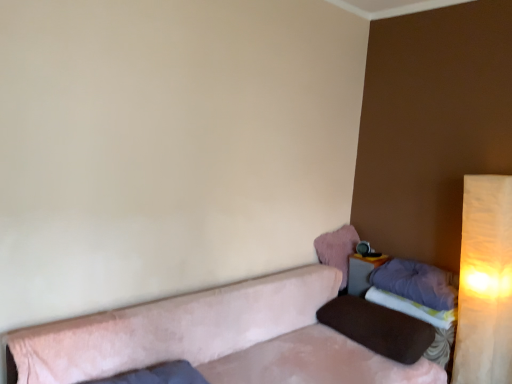
Question: From a real-world perspective, is suede-like beige couch at lower right positioned above or below warm beige fabric lampshade at right?

Choices:
 (A) below
 (B) above

Answer: (A)

Question: From the image's perspective, is suede-like beige couch at lower right positioned above or below warm beige fabric lampshade at right?

Choices:
 (A) above
 (B) below

Answer: (B)

Question: Which is nearer to the suede-like beige couch at lower right?

Choices:
 (A) purple soft pillow at right, arranged as the second pillow when ordered from the bottom
 (B) pink fluffy pillow at upper right, arranged as the third pillow when ordered from the bottom
 (C) purple fabric sheet at lower right
 (D) matte gray table at lower right
 (E) warm beige fabric lampshade at right

Answer: (A)

Question: Which object is positioned farthest from the brown fabric pillow at right, which appears as the third pillow when viewed from the top?

Choices:
 (A) pink fluffy pillow at upper right, which is the first pillow in top-to-bottom order
 (B) suede-like beige couch at lower right
 (C) purple fabric sheet at lower right
 (D) purple soft pillow at right, arranged as the second pillow when ordered from the bottom
 (E) warm beige fabric lampshade at right

Answer: (A)